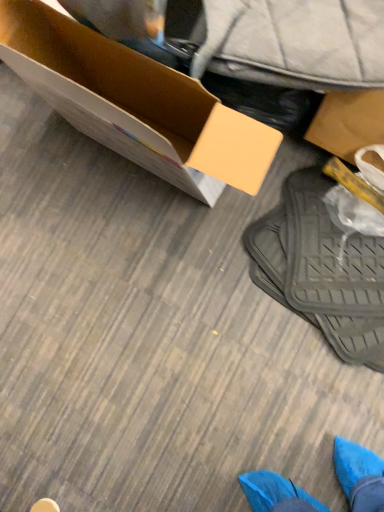
Question: Considering the relative positions of blue suede shoe at lower left and black rubber mat at lower right in the image provided, is blue suede shoe at lower left to the left of black rubber mat at lower right from the viewer's perspective?

Choices:
 (A) yes
 (B) no

Answer: (A)

Question: Is blue suede shoe at lower left located outside black rubber mat at lower right?

Choices:
 (A) no
 (B) yes

Answer: (B)

Question: Considering the relative sizes of blue suede shoe at lower left and black rubber mat at lower right in the image provided, is blue suede shoe at lower left taller than black rubber mat at lower right?

Choices:
 (A) yes
 (B) no

Answer: (B)

Question: From a real-world perspective, is blue suede shoe at lower left below black rubber mat at lower right?

Choices:
 (A) no
 (B) yes

Answer: (B)

Question: Is the position of blue suede shoe at lower left less distant than that of black rubber mat at lower right?

Choices:
 (A) yes
 (B) no

Answer: (B)

Question: From the image's perspective, relative to black rubber mat at lower right, is blue suede shoe at lower left above or below?

Choices:
 (A) below
 (B) above

Answer: (A)

Question: Is blue suede shoe at lower left taller or shorter than black rubber mat at lower right?

Choices:
 (A) short
 (B) tall

Answer: (A)

Question: Relative to black rubber mat at lower right, is blue suede shoe at lower left in front or behind?

Choices:
 (A) behind
 (B) front

Answer: (A)

Question: Is blue suede shoe at lower left situated inside black rubber mat at lower right or outside?

Choices:
 (A) outside
 (B) inside

Answer: (A)

Question: Relative to cardboard box at upper left, is blue suede shoe at lower left in front or behind?

Choices:
 (A) front
 (B) behind

Answer: (B)

Question: Looking at the image, does blue suede shoe at lower left seem bigger or smaller compared to cardboard box at upper left?

Choices:
 (A) small
 (B) big

Answer: (A)

Question: Is point (54, 509) closer or farther from the camera than point (49, 57)?

Choices:
 (A) farther
 (B) closer

Answer: (A)

Question: From the image's perspective, is blue suede shoe at lower left located above or below cardboard box at upper left?

Choices:
 (A) below
 (B) above

Answer: (A)

Question: Considering the positions of black rubber mat at lower right and cardboard box at upper left in the image, is black rubber mat at lower right wider or thinner than cardboard box at upper left?

Choices:
 (A) thin
 (B) wide

Answer: (B)

Question: From a real-world perspective, is black rubber mat at lower right above or below cardboard box at upper left?

Choices:
 (A) below
 (B) above

Answer: (A)